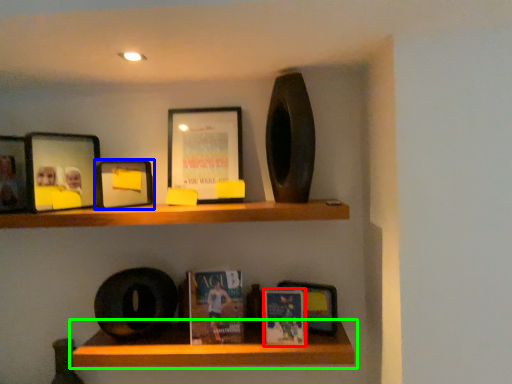
Question: Which object is positioned closest to paperback book (highlighted by a red box)? Select from picture frame (highlighted by a blue box) and shelf (highlighted by a green box).

Choices:
 (A) picture frame
 (B) shelf

Answer: (B)